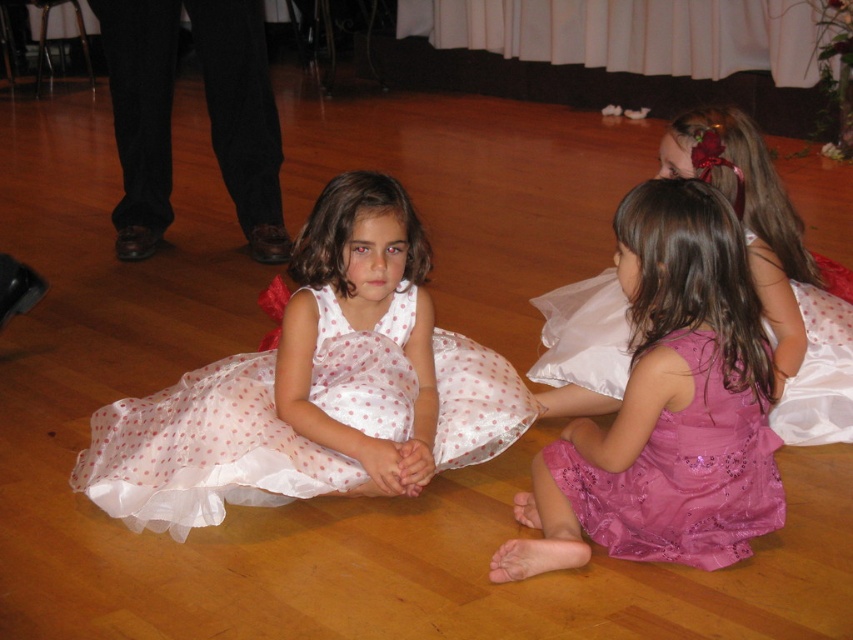
Can you confirm if white sheer dress at center is positioned below pink satin dress at lower right?

Correct, white sheer dress at center is located below pink satin dress at lower right.

Looking at this image, which is more to the right, white sheer dress at center or pink satin dress at lower right?

Positioned to the right is pink satin dress at lower right.

Where is `white sheer dress at center`? This screenshot has width=853, height=640. white sheer dress at center is located at coordinates (204, 451).

Does point (705, 220) come closer to viewer compared to point (699, 531)?

Yes, point (705, 220) is closer to viewer.

Does purple sequined dress at lower right have a lesser width compared to pink sequined dress at lower right?

No.

Is point (669, 243) more distant than point (732, 518)?

No.

Locate an element on the screen. The height and width of the screenshot is (640, 853). purple sequined dress at lower right is located at coordinates (666, 406).

Is pink sequined dress at lower right positioned behind pink satin dress at lower right?

No, it is not.

Who is more forward, (718, 442) or (624, 372)?

Point (718, 442) is more forward.

Between point (751, 534) and point (608, 305), which one is positioned in front?

Positioned in front is point (751, 534).

The image size is (853, 640). I want to click on pink sequined dress at lower right, so click(x=683, y=474).